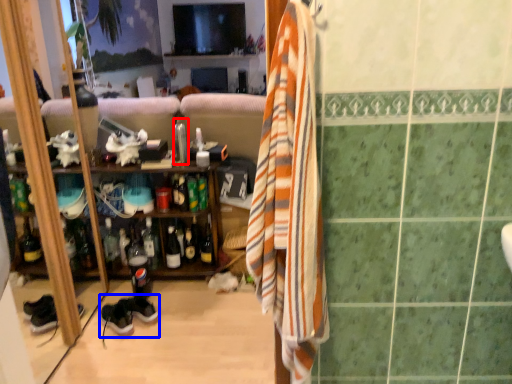
Question: Which object is further to the camera taking this photo, faucet (highlighted by a red box) or shoe (highlighted by a blue box)?

Choices:
 (A) faucet
 (B) shoe

Answer: (A)